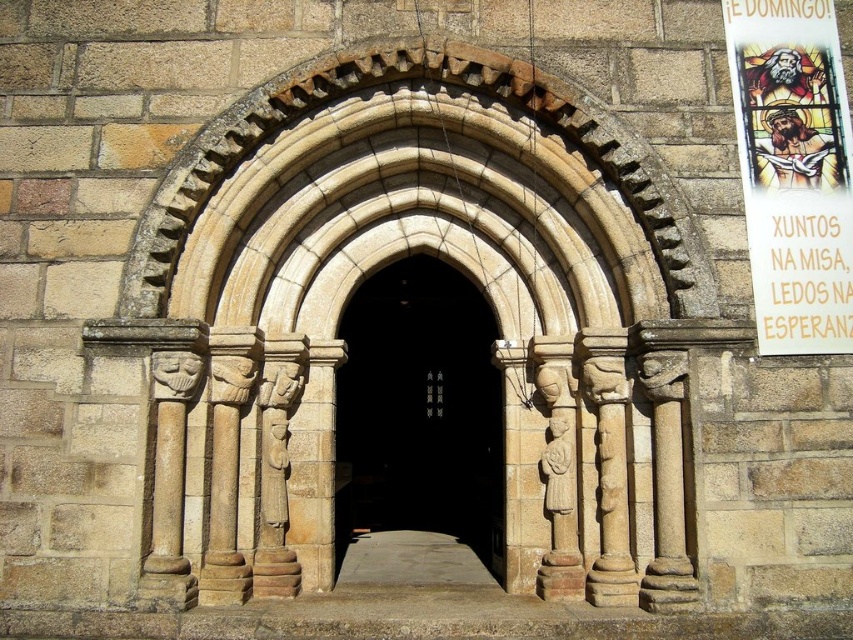
You are an art student analyzing the composition of the image. You notice the smooth stone arch at center and the white paper poster at upper right. Based on their positions, which object is closer to the viewer?

The smooth stone arch at center is closer to the viewer because the white paper poster at upper right is behind it.

You are standing in front of the stone archway and notice two points marked on the image. The first point is at coordinates point (396, 492) and the second is at point (816, 112). Which point is closer to you?

Point (816, 112) is closer to you because it is in front of point (396, 492).